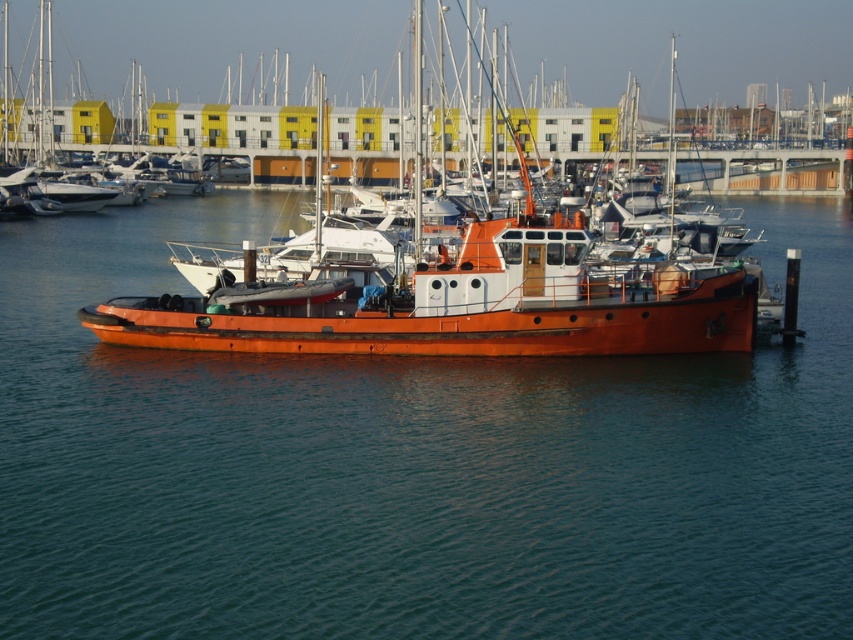
You are a sailor who needs to board the orange polished wood boat at center. From the dock, which direction should you look to see the glossy water at center before boarding?

The glossy water at center is shorter than the orange polished wood boat at center, so you should look downward to see the glossy water at center before boarding.

You are a photographer planning to capture the orange polished wood boat at center and the glossy water at center in a single frame. Based on their sizes, which object should you focus on first to ensure both fit in the composition?

The glossy water at center is smaller than the orange polished wood boat at center, so you should focus on the orange polished wood boat at center first to ensure both fit in the composition.

You are standing on the pier where the bright orange tugboat is docked. You want to locate the glossy water at center. According to the coordinates provided, in which direction should you look relative to the tugboat?

The glossy water at center is located at coordinates point (x=412, y=465). Since the tugboat is docked at the pier, you should look towards the center of the marina, which would be forward and slightly to the right from the tugboat.